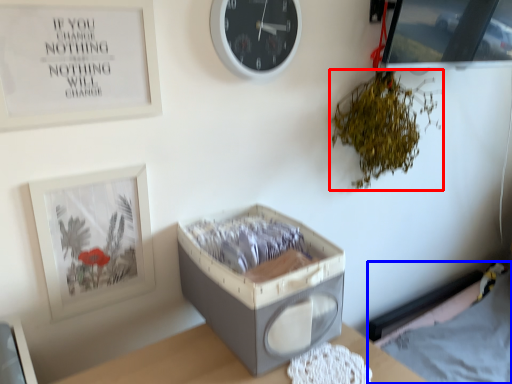
Question: Which of the following is the closest to the observer, plant (highlighted by a red box) or hospital bed (highlighted by a blue box)?

Choices:
 (A) plant
 (B) hospital bed

Answer: (A)